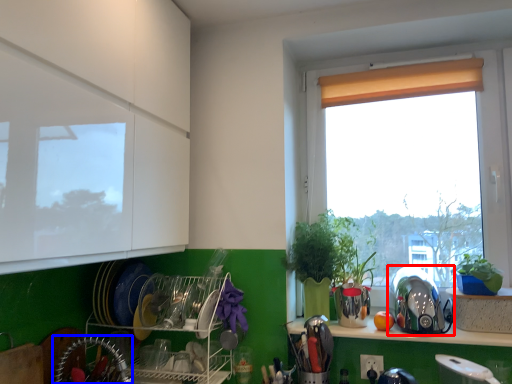
Question: Among these objects, which one is farthest to the camera, appliance (highlighted by a red box) or appliance (highlighted by a blue box)?

Choices:
 (A) appliance
 (B) appliance

Answer: (A)